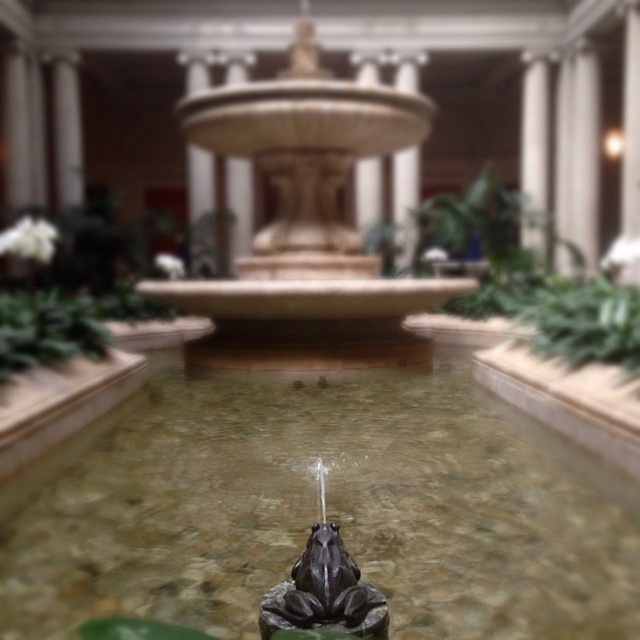
Between beige stone fountain at center and green leafy plant at center, which one has more height?

green leafy plant at center

In order to click on beige stone fountain at center in this screenshot , I will do `click(305, 224)`.

At what (x,y) coordinates should I click in order to perform the action: click on beige stone fountain at center. Please return your answer as a coordinate pair (x, y). Image resolution: width=640 pixels, height=640 pixels. Looking at the image, I should click on (305, 224).

Is clear water at center smaller than beige stone fountain at center?

Yes.

Is the position of clear water at center more distant than that of beige stone fountain at center?

No.

I want to click on clear water at center, so click(328, 509).

Does clear water at center have a greater height compared to green leafy plant at center?

In fact, clear water at center may be shorter than green leafy plant at center.

Can you confirm if clear water at center is smaller than green leafy plant at center?

Yes.

Where is `clear water at center`? The height and width of the screenshot is (640, 640). clear water at center is located at coordinates (328, 509).